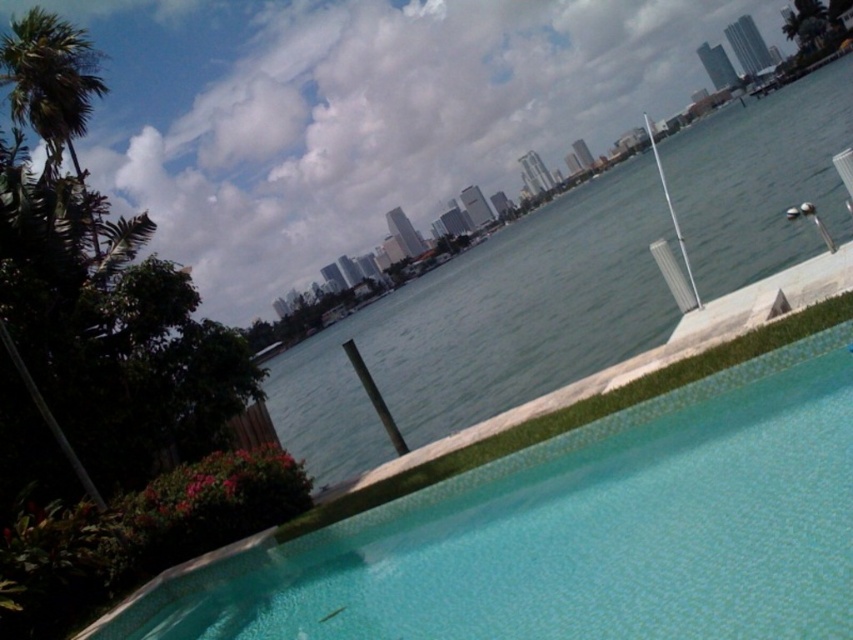
You are standing at the edge of the clear glass pool at lower right and want to throw a pebble into the clear water at center. Will the pebble land closer to you or farther away from you once it hits the water?

The clear glass pool at lower right is closer to the viewer than clear water at center, so the pebble will land farther away from you when it reaches the clear water at center.

You are standing at the edge of the pool and want to walk to the point marked by point (718,346) and then to point (743,160). Based on the scene, which path would require you to walk further away from the pool?

The path to point (743,160) requires walking further away from the pool because it is farther from the viewer compared to point (718,346).

From the picture: You are a landscape architect designing a new garden. You need to place a decorative statue that requires a base 1 meter tall. You have two options for placement locations in the scene described. The first option is near the clear glass pool at lower right, and the second is near the clear water at center. Based on the height of these two water features, which location would provide a stable base for the statue?

The clear water at center is taller than the clear glass pool at lower right, so placing the statue near the clear water at center would provide a more stable base since it has sufficient height for the statue.